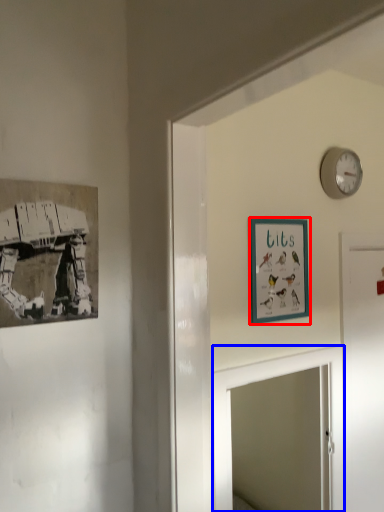
Question: Which point is closer to the camera, picture frame (highlighted by a red box) or mirror (highlighted by a blue box)?

Choices:
 (A) picture frame
 (B) mirror

Answer: (B)